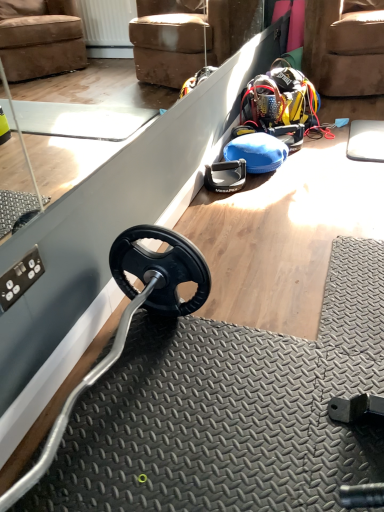
Locate an element on the screen. The width and height of the screenshot is (384, 512). free location in front of black rubber weight at center is located at coordinates (229, 202).